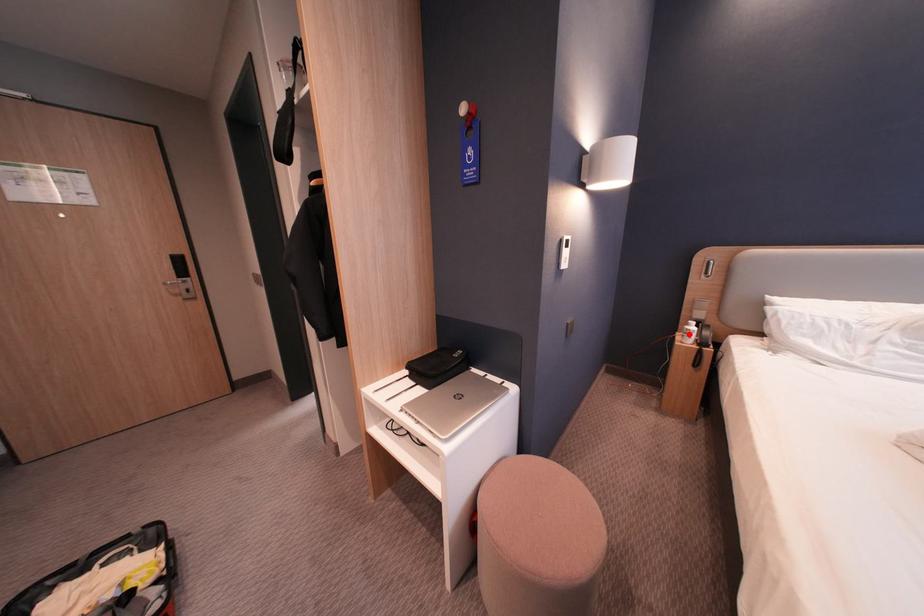
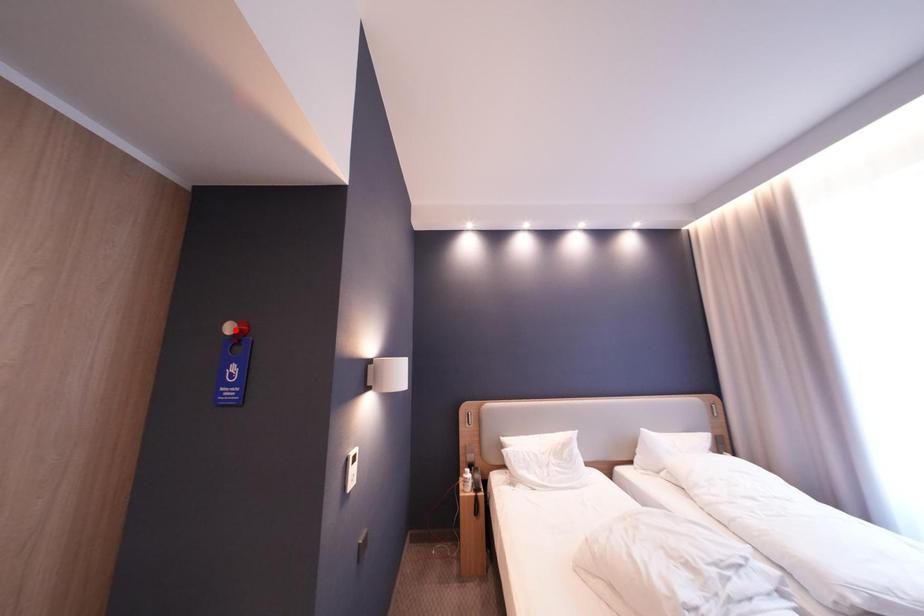
I am providing you with two images of the same scene from different viewpoints. A red point is marked on the first image and another point is marked on the second image. Does the point marked in image1 correspond to the same location as the one in image2?

No